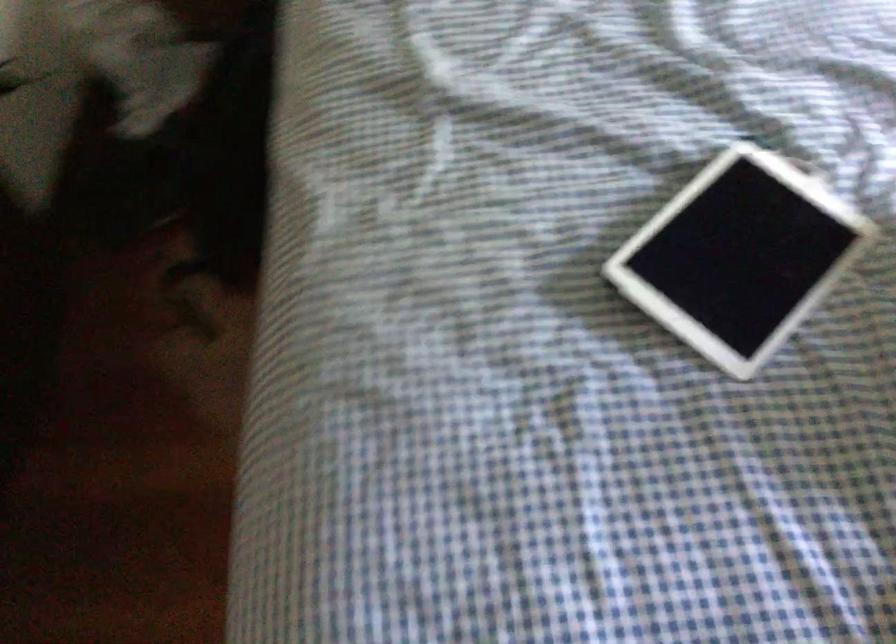
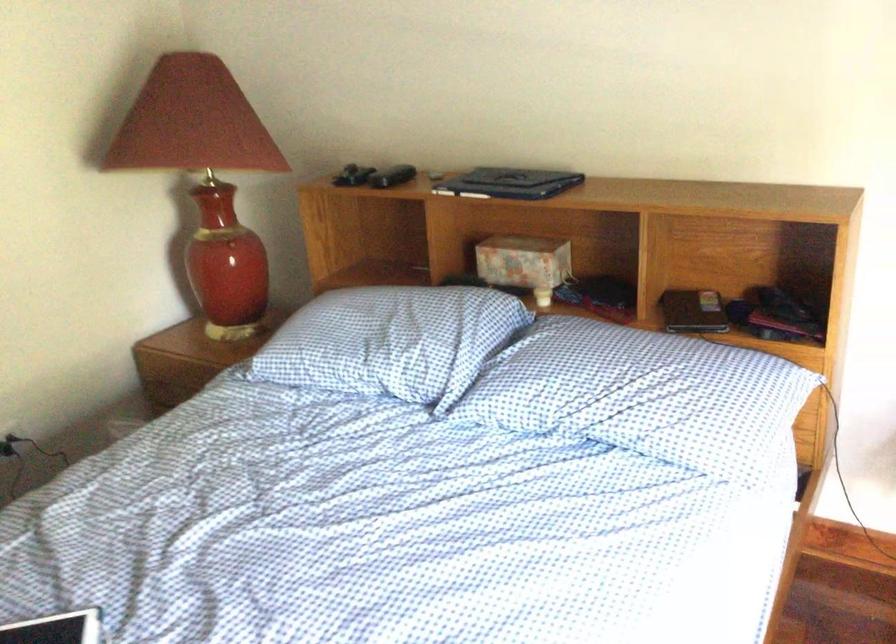
Locate, in the second image, the point that corresponds to the point at 711,205 in the first image.

(56, 629)